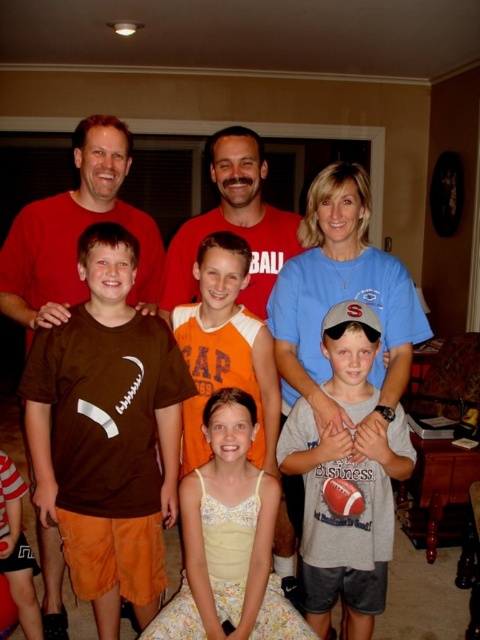
You are a photographer trying to capture a closeup of the gray cotton shirt at center and the yellow lace dress at center. Which one is to the right of the other?

The gray cotton shirt at center is positioned on the right side of yellow lace dress at center.